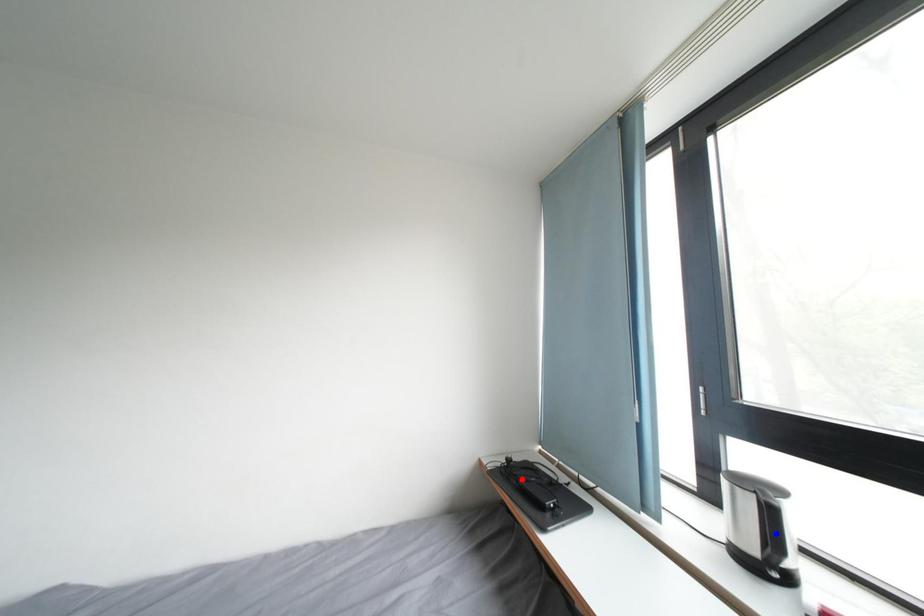
Question: Two points are marked on the image. Which point is closer to the camera?

Choices:
 (A) Blue point is closer.
 (B) Red point is closer.

Answer: (A)